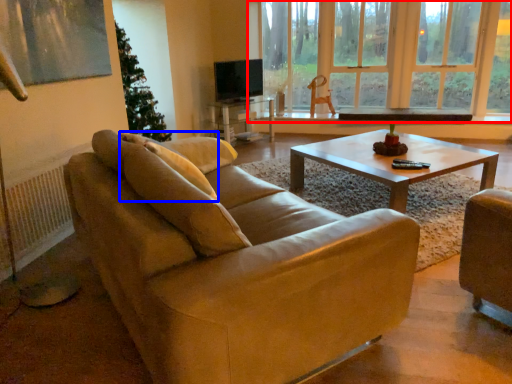
Question: Which point is closer to the camera, window (highlighted by a red box) or pillow (highlighted by a blue box)?

Choices:
 (A) window
 (B) pillow

Answer: (B)